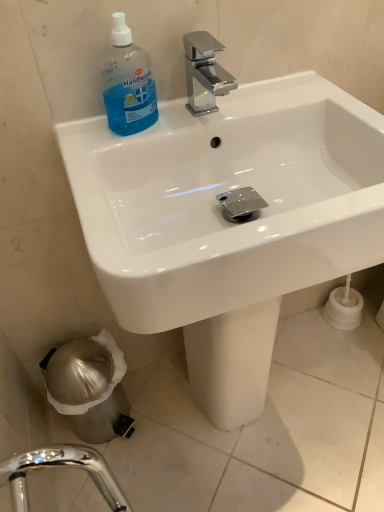
Question: Is blue translucent plastic handwash at upper left at the right side of white glossy sink at upper center?

Choices:
 (A) no
 (B) yes

Answer: (A)

Question: Does blue translucent plastic handwash at upper left appear on the left side of white glossy sink at upper center?

Choices:
 (A) yes
 (B) no

Answer: (A)

Question: Is blue translucent plastic handwash at upper left facing away from white glossy sink at upper center?

Choices:
 (A) no
 (B) yes

Answer: (B)

Question: Is blue translucent plastic handwash at upper left shorter than white glossy sink at upper center?

Choices:
 (A) no
 (B) yes

Answer: (B)

Question: Is blue translucent plastic handwash at upper left positioned behind white glossy sink at upper center?

Choices:
 (A) yes
 (B) no

Answer: (A)

Question: Would you consider blue translucent plastic handwash at upper left to be distant from white glossy sink at upper center?

Choices:
 (A) no
 (B) yes

Answer: (A)

Question: Considering the relative positions of white glossy sink at upper center and blue translucent plastic handwash at upper left in the image provided, is white glossy sink at upper center to the left of blue translucent plastic handwash at upper left from the viewer's perspective?

Choices:
 (A) yes
 (B) no

Answer: (B)

Question: Is white glossy sink at upper center to the right of blue translucent plastic handwash at upper left from the viewer's perspective?

Choices:
 (A) yes
 (B) no

Answer: (A)

Question: Would you say white glossy sink at upper center is a long distance from blue translucent plastic handwash at upper left?

Choices:
 (A) no
 (B) yes

Answer: (A)

Question: Is the position of white glossy sink at upper center more distant than that of blue translucent plastic handwash at upper left?

Choices:
 (A) no
 (B) yes

Answer: (A)

Question: Is white glossy sink at upper center thinner than blue translucent plastic handwash at upper left?

Choices:
 (A) no
 (B) yes

Answer: (A)

Question: From the image's perspective, is white glossy sink at upper center on blue translucent plastic handwash at upper left?

Choices:
 (A) yes
 (B) no

Answer: (B)

Question: Considering the positions of point (370, 147) and point (129, 113), is point (370, 147) closer or farther from the camera than point (129, 113)?

Choices:
 (A) closer
 (B) farther

Answer: (B)